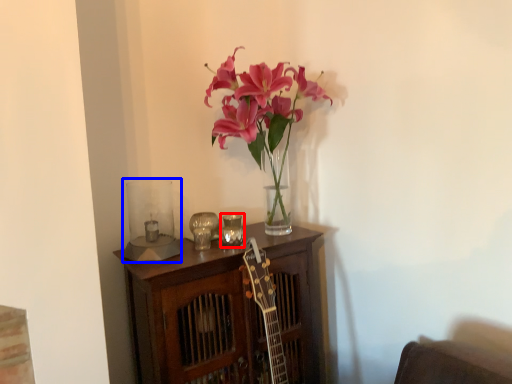
Question: Which of the following is the farthest to the observer, candle holder (highlighted by a red box) or candle holder (highlighted by a blue box)?

Choices:
 (A) candle holder
 (B) candle holder

Answer: (A)